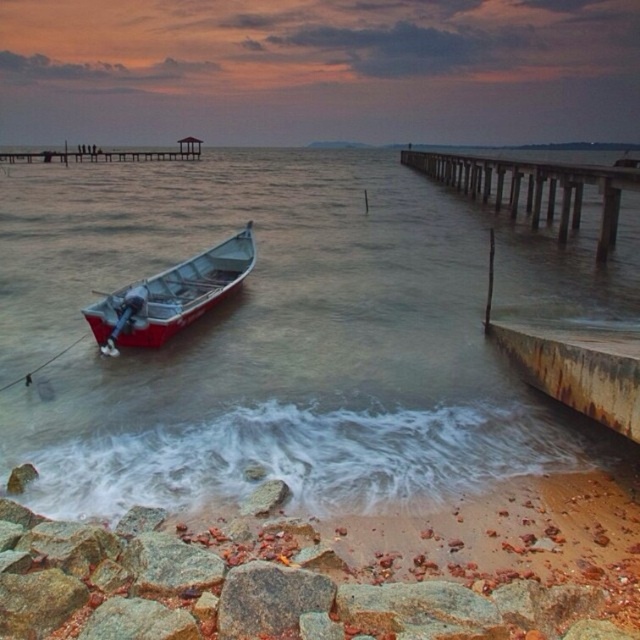
At what (x,y) coordinates should I click in order to perform the action: click on wooden pier at right. Please return your answer as a coordinate pair (x, y). This screenshot has width=640, height=640. Looking at the image, I should click on (532, 188).

Which is above, clear water at boat left or red polished wood boat at left?

clear water at boat left

Describe the element at coordinates (285, 333) in the screenshot. I see `clear water at boat left` at that location.

Identify the location of clear water at boat left. The width and height of the screenshot is (640, 640). (285, 333).

In the scene shown: Does clear water at boat left have a lesser height compared to wooden pier at right?

Indeed, clear water at boat left has a lesser height compared to wooden pier at right.

Is point (396, 243) farther from viewer compared to point (528, 173)?

No, (396, 243) is closer to viewer.

In the scene shown: Measure the distance between clear water at boat left and camera.

5.34 meters

What are the coordinates of `clear water at boat left` in the screenshot? It's located at (285, 333).